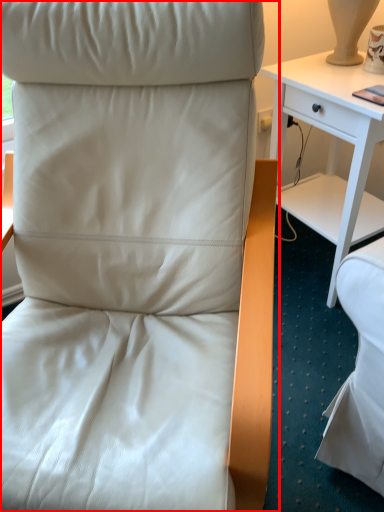
Question: Considering the relative positions of chair (annotated by the red box) and desk in the image provided, where is chair (annotated by the red box) located with respect to the staircase?

Choices:
 (A) left
 (B) right

Answer: (A)